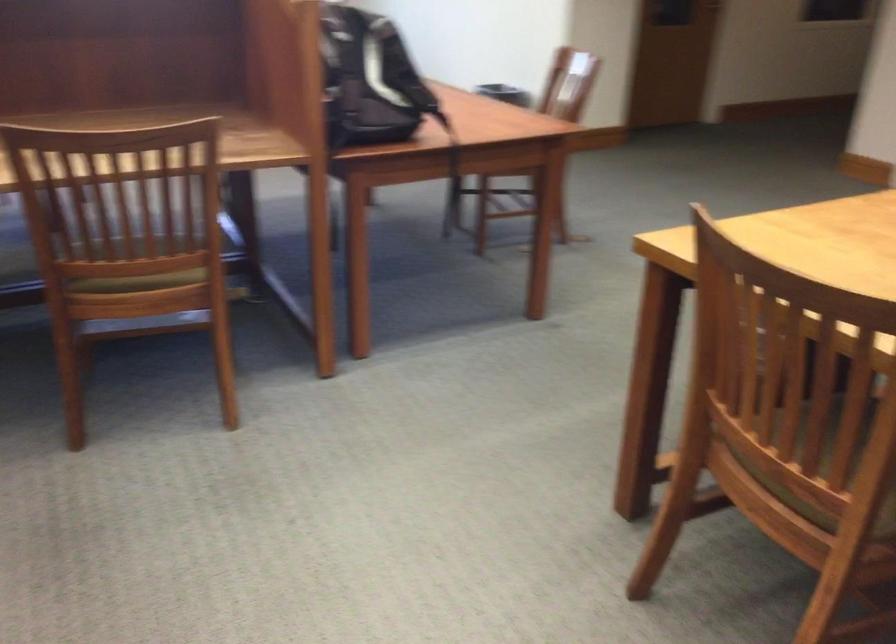
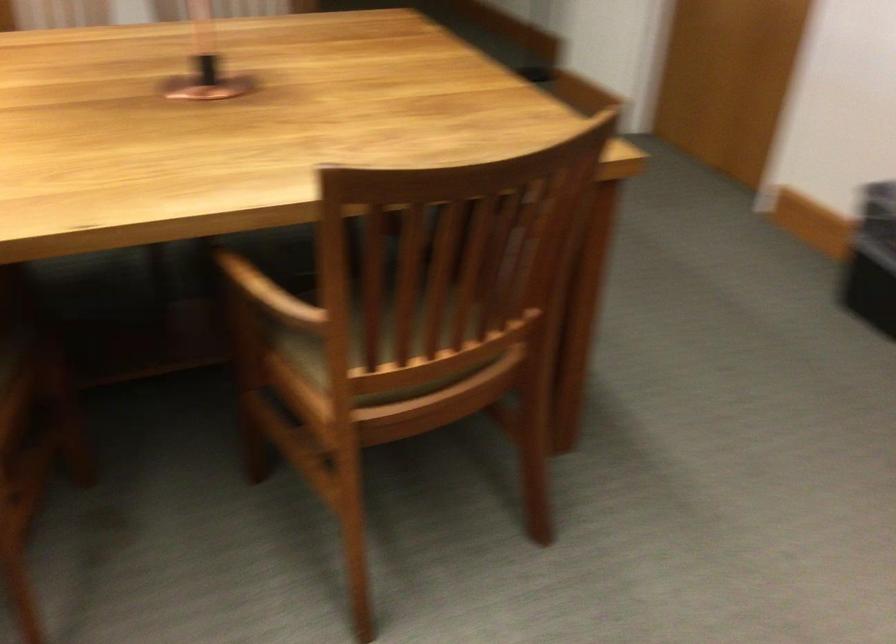
The images are taken continuously from a first-person perspective. In which direction is your viewpoint rotating?

The camera's rotation is toward right-down.